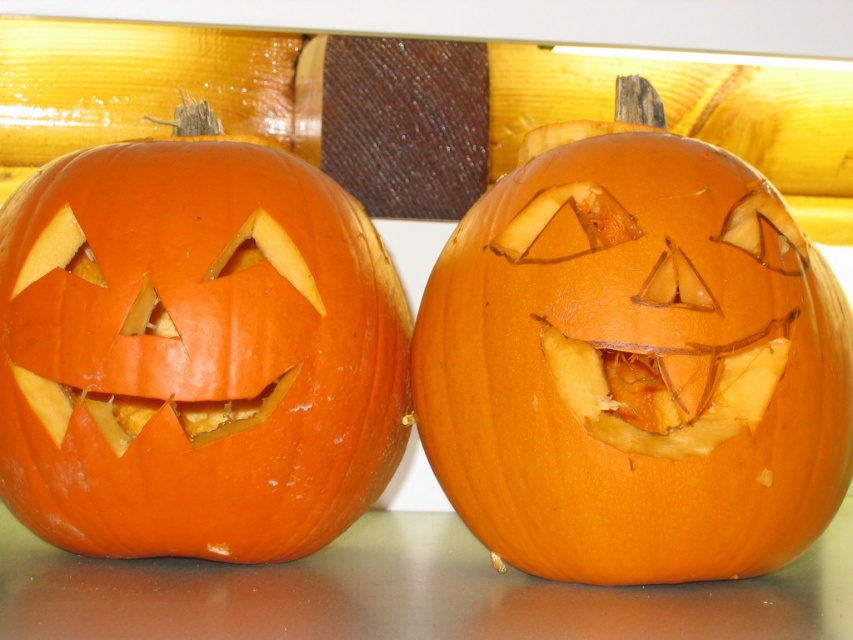
Based on the photo, is orange carved pumpkin at center shorter than orange matte pumpkin at left?

Incorrect, orange carved pumpkin at center's height does not fall short of orange matte pumpkin at left's.

Find the location of a particular element. This screenshot has height=640, width=853. orange carved pumpkin at center is located at coordinates (634, 362).